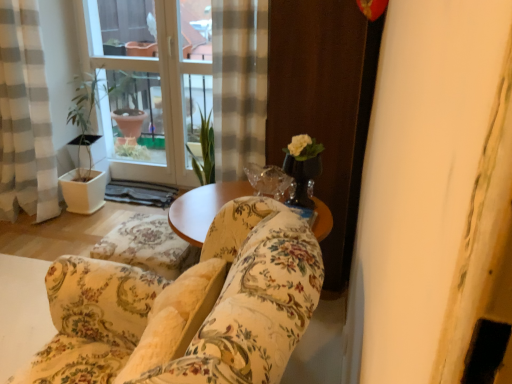
Question: From the image's perspective, is transparent glass vase at center on transparent glass window at upper left?

Choices:
 (A) no
 (B) yes

Answer: (A)

Question: From a real-world perspective, is transparent glass vase at center over transparent glass window at upper left?

Choices:
 (A) no
 (B) yes

Answer: (B)

Question: Does transparent glass vase at center have a greater height compared to transparent glass window at upper left?

Choices:
 (A) yes
 (B) no

Answer: (B)

Question: Considering the relative sizes of transparent glass vase at center and transparent glass window at upper left in the image provided, is transparent glass vase at center bigger than transparent glass window at upper left?

Choices:
 (A) yes
 (B) no

Answer: (B)

Question: Is transparent glass vase at center not inside transparent glass window at upper left?

Choices:
 (A) yes
 (B) no

Answer: (A)

Question: Can transparent glass window at upper left be found inside transparent glass vase at center?

Choices:
 (A) no
 (B) yes

Answer: (A)

Question: Does floral fabric sofa at center lie in front of transparent glass vase at center?

Choices:
 (A) yes
 (B) no

Answer: (B)

Question: Does floral fabric sofa at center have a lesser width compared to transparent glass vase at center?

Choices:
 (A) yes
 (B) no

Answer: (B)

Question: Does floral fabric sofa at center appear on the left side of transparent glass vase at center?

Choices:
 (A) yes
 (B) no

Answer: (A)

Question: From a real-world perspective, is floral fabric sofa at center located higher than transparent glass vase at center?

Choices:
 (A) no
 (B) yes

Answer: (A)

Question: Is floral fabric sofa at center further to the viewer compared to transparent glass vase at center?

Choices:
 (A) yes
 (B) no

Answer: (A)

Question: Is transparent glass vase at center at the back of floral fabric sofa at center?

Choices:
 (A) no
 (B) yes

Answer: (A)

Question: From a real-world perspective, is wooden screen door at right positioned over gray checkered curtain at left based on gravity?

Choices:
 (A) yes
 (B) no

Answer: (A)